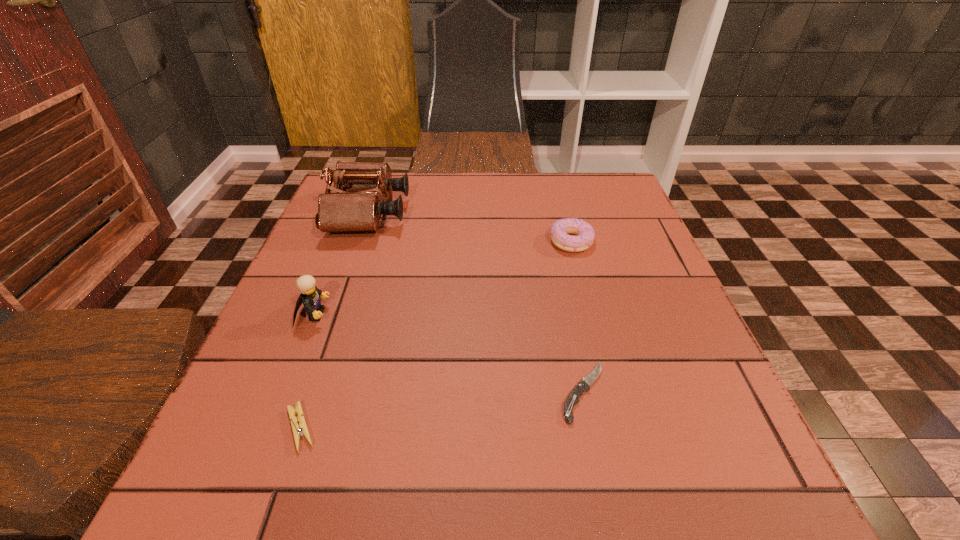
Locate an element on the screen. Image resolution: width=960 pixels, height=540 pixels. the tallest object is located at coordinates (356, 206).

Locate an element on the screen. Image resolution: width=960 pixels, height=540 pixels. the second tallest object is located at coordinates (310, 295).

Where is `Lego`? Lego is located at coordinates (310, 295).

You are a GUI agent. You are given a task and a screenshot of the screen. Output one action in this format:
    pyautogui.click(x=<x>, y=<y>)
    Task: Click on the doughnut
    
    Given the screenshot: What is the action you would take?
    pyautogui.click(x=585, y=234)

Locate an element on the screen. pocketknife is located at coordinates (573, 398).

Where is `clothespin`? clothespin is located at coordinates (298, 431).

Image resolution: width=960 pixels, height=540 pixels. Identify the location of free space located 0.050m through the eyepieces of the binoculars. (426, 214).

Identify the location of vacant space located 0.120m on the front-facing side of the fourth shortest object. (391, 314).

In order to click on free space located 0.200m on the front of the doughnut in this screenshot , I will do `click(592, 320)`.

Where is `free space located on the left of the pocketknife`? This screenshot has height=540, width=960. free space located on the left of the pocketknife is located at coordinates 529,392.